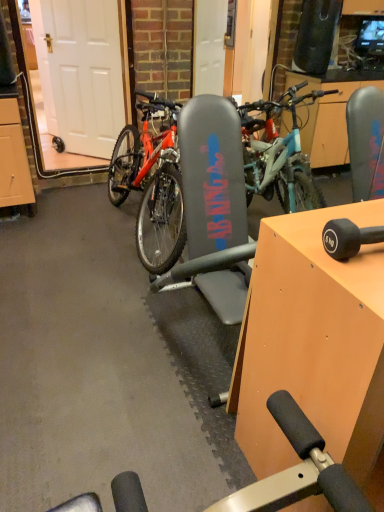
Describe the element at coordinates (80, 72) in the screenshot. I see `white matte door at left` at that location.

Image resolution: width=384 pixels, height=512 pixels. I want to click on matte black bicycle at center, so click(x=151, y=177).

Considering the positions of points (248, 164) and (292, 386), is point (248, 164) closer to camera compared to point (292, 386)?

No, it is not.

In terms of width, does matte black bicycle at center look wider or thinner when compared to orange wood table at center?

matte black bicycle at center is wider than orange wood table at center.

Is matte black bicycle at center with orange wood table at center?

matte black bicycle at center and orange wood table at center are not in contact.

Is matte black bicycle at center spatially inside orange wood table at center, or outside of it?

matte black bicycle at center is not inside orange wood table at center, it's outside.

Where is `bicycle behind the orange wood table at center`? This screenshot has height=512, width=384. bicycle behind the orange wood table at center is located at coordinates (151, 177).

Which of these two, orange wood table at center or matte black bicycle at center, stands taller?

matte black bicycle at center.

In the scene shown: From the image's perspective, is orange wood table at center positioned above or below matte black bicycle at center?

Clearly, from the image's perspective, orange wood table at center is below matte black bicycle at center.

From a real-world perspective, relative to matte black bicycle at center, is orange wood table at center vertically above or below?

orange wood table at center is below matte black bicycle at center.

Is point (157, 201) positioned in front of point (101, 124)?

Yes, it is in front of point (101, 124).

In the scene shown: Between matte black bicycle at center and white matte door at left, which one has smaller size?

white matte door at left is smaller.

Find the location of a particular element. garage door on the left of matte black bicycle at center is located at coordinates (80, 72).

Would you say matte black bicycle at center is inside or outside white matte door at left?

matte black bicycle at center is not enclosed by white matte door at left.

Identify the location of garage door above the orange wood table at center (from a real-world perspective). (80, 72).

How different are the orientations of white matte door at left and orange wood table at center in degrees?

45.6 degrees.

From the image's perspective, which is below, white matte door at left or orange wood table at center?

From the image's view, orange wood table at center is below.

Image resolution: width=384 pixels, height=512 pixels. Identify the location of table in front of the white matte door at left. (310, 367).

Does orange wood table at center have a smaller size compared to white matte door at left?

Actually, orange wood table at center might be larger than white matte door at left.

Looking at their sizes, would you say orange wood table at center is wider or thinner than white matte door at left?

In the image, orange wood table at center appears to be wider than white matte door at left.

Are white matte door at left and matte black bicycle at center far apart?

That's not correct — white matte door at left is a little close to matte black bicycle at center.

Can you confirm if white matte door at left is positioned to the left of matte black bicycle at center?

Yes, white matte door at left is to the left of matte black bicycle at center.

How different are the orientations of white matte door at left and matte black bicycle at center in degrees?

The angle between the facing direction of white matte door at left and the facing direction of matte black bicycle at center is 43.4 degrees.

Locate an element on the screen. Image resolution: width=384 pixels, height=512 pixels. bicycle behind the orange wood table at center is located at coordinates (151, 177).

Image resolution: width=384 pixels, height=512 pixels. I want to click on bicycle above the orange wood table at center (from a real-world perspective), so click(x=151, y=177).

From the picture: Which object lies nearer to the anchor point matte black bicycle at center, orange wood table at center or white matte door at left?

white matte door at left.

Which object lies further to the anchor point matte black bicycle at center, white matte door at left or orange wood table at center?

orange wood table at center lies further to matte black bicycle at center than the other object.

When comparing their distances from white matte door at left, does orange wood table at center or matte black bicycle at center seem further?

The object further to white matte door at left is orange wood table at center.

Estimate the real-world distances between objects in this image. Which object is closer to orange wood table at center, matte black bicycle at center or white matte door at left?

matte black bicycle at center is positioned closer to the anchor orange wood table at center.

Which object lies nearer to the anchor point orange wood table at center, white matte door at left or matte black bicycle at center?

matte black bicycle at center is closer to orange wood table at center.

From the image, which object appears to be nearer to white matte door at left, matte black bicycle at center or orange wood table at center?

matte black bicycle at center is closer to white matte door at left.

At what (x,y) coordinates should I click in order to perform the action: click on bicycle positioned between orange wood table at center and white matte door at left from near to far. Please return your answer as a coordinate pair (x, y). Image resolution: width=384 pixels, height=512 pixels. Looking at the image, I should click on (151, 177).